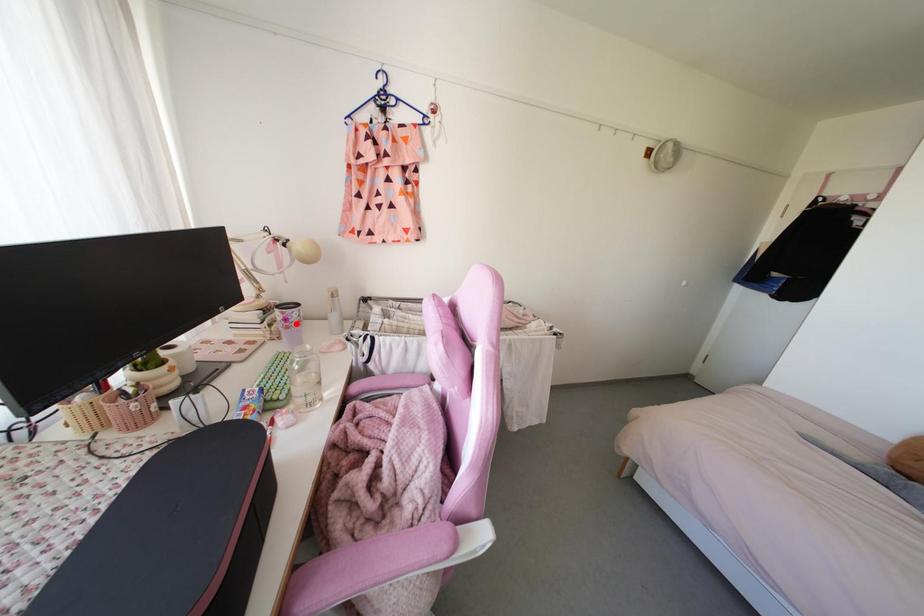
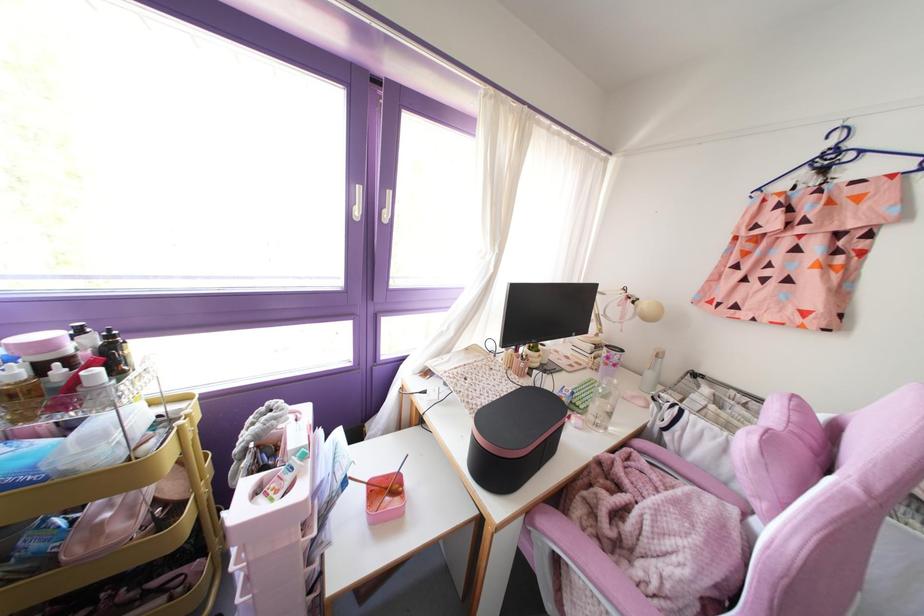
The point at the highlighted location is marked in the first image. Where is the corresponding point in the second image?

(614, 365)